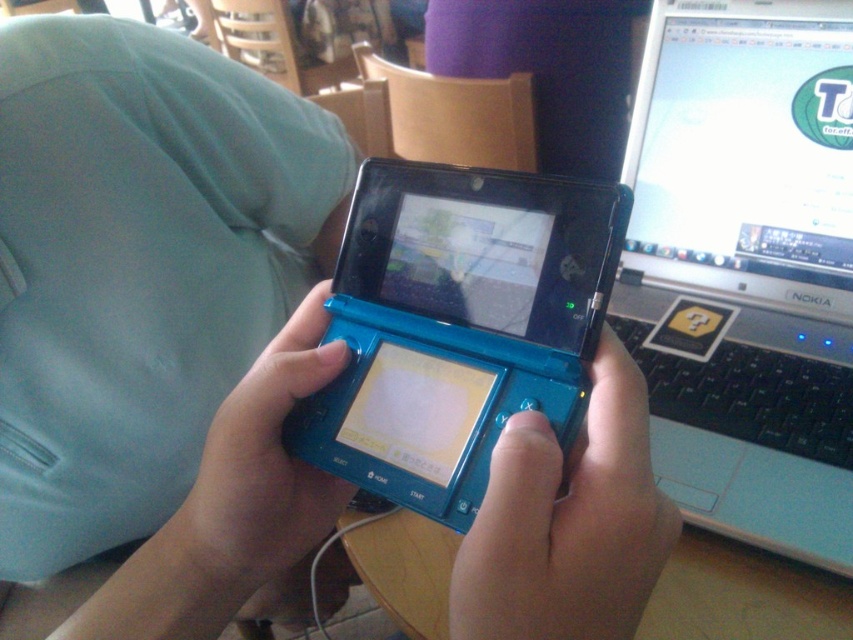
You are organizing a tech exhibition and need to place both the matte plastic laptop at upper right and the teal plastic game controller at center on a shelf. Given their sizes, which one should you place first to ensure stability?

The matte plastic laptop at upper right is larger than the teal plastic game controller at center, so you should place the matte plastic laptop at upper right first to ensure stability.